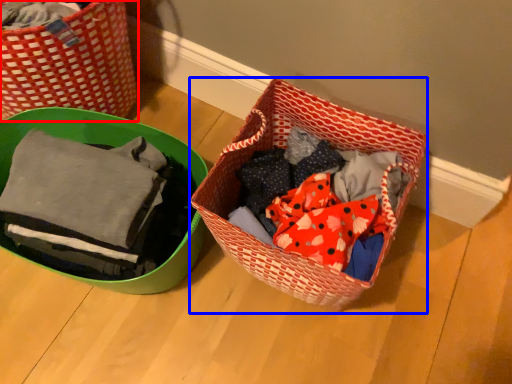
Question: Which point is further to the camera, picnic basket (highlighted by a red box) or picnic basket (highlighted by a blue box)?

Choices:
 (A) picnic basket
 (B) picnic basket

Answer: (A)